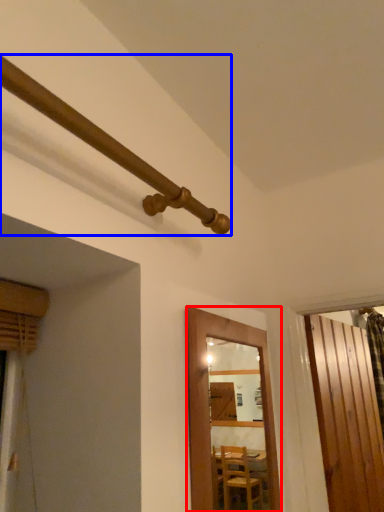
Question: Which object appears farthest to the camera in this image, door (highlighted by a red box) or pipe (highlighted by a blue box)?

Choices:
 (A) door
 (B) pipe

Answer: (A)